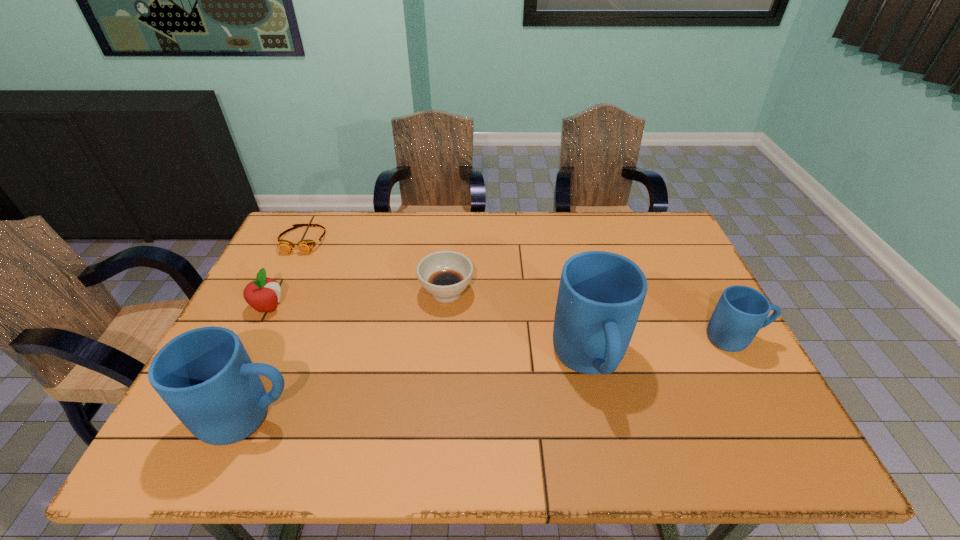
Locate an element on the screen. This screenshot has height=540, width=960. free area in between the fourth shortest object and the second mug from left to right is located at coordinates (662, 350).

Identify the location of vacant space in between the farthest object and the shortest mug. (519, 289).

Where is `vacant region between the fourth tallest object and the farthest object`? The image size is (960, 540). vacant region between the fourth tallest object and the farthest object is located at coordinates (286, 274).

Image resolution: width=960 pixels, height=540 pixels. Identify the location of object identified as the fourth closest to the shortest object. (601, 294).

Point out which object is positioned as the fifth nearest to the fourth shortest object. Please provide its 2D coordinates. Your answer should be formatted as a tuple, i.e. [(x, y)], where the tuple contains the x and y coordinates of a point satisfying the conditions above.

[(305, 246)]

Select which mug is the second closest to the leftmost mug. Please provide its 2D coordinates. Your answer should be formatted as a tuple, i.e. [(x, y)], where the tuple contains the x and y coordinates of a point satisfying the conditions above.

[(741, 311)]

Select which mug appears as the second closest to the leftmost mug. Please provide its 2D coordinates. Your answer should be formatted as a tuple, i.e. [(x, y)], where the tuple contains the x and y coordinates of a point satisfying the conditions above.

[(741, 311)]

Find the location of `vacant region that satisfies the following two spatial constraints: 1. on the side of the rightmost object with the handle; 2. on the side of the second object from right to left with the handle`. vacant region that satisfies the following two spatial constraints: 1. on the side of the rightmost object with the handle; 2. on the side of the second object from right to left with the handle is located at coordinates pos(748,362).

Locate an element on the screen. This screenshot has width=960, height=540. vacant space that satisfies the following two spatial constraints: 1. on the side of the fifth object from left to right with the handle; 2. on the side of the leftmost mug with the handle is located at coordinates (602, 417).